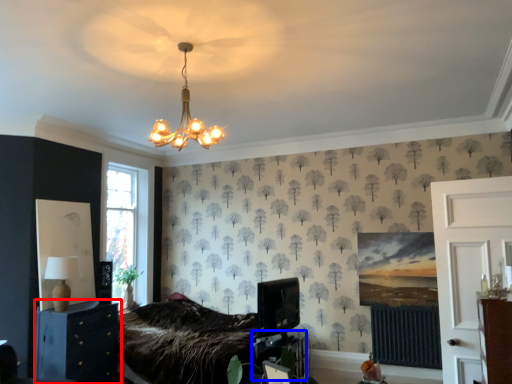
Question: Which object appears closest to the camera in this image, furniture (highlighted by a red box) or table (highlighted by a blue box)?

Choices:
 (A) furniture
 (B) table

Answer: (A)